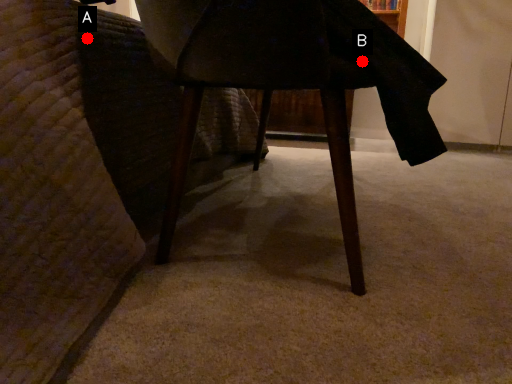
Question: Two points are circled on the image, labeled by A and B beside each circle. Which point is closer to the camera?

Choices:
 (A) A is closer
 (B) B is closer

Answer: (B)